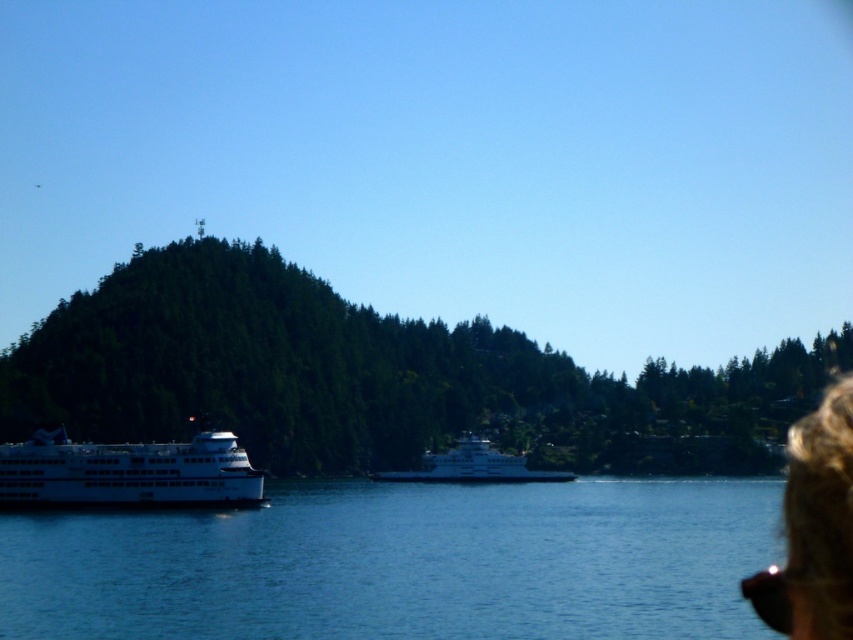
You are a photographer trying to capture both the green textured hillside at center and the white glossy ferry at lower left in a single shot. Which object should you focus on first to ensure both are in frame?

You should focus on the green textured hillside at center first because it is closer to you than the white glossy ferry at lower left, so adjusting the camera to include it ensures the ferry further back will also be in the frame.

You are a passenger on the ferry and want to move from the white glossy ferry at lower left to the white glossy ferry at center. Which direction should you go to reach it?

The white glossy ferry at lower left is to the left of the white glossy ferry at center. To reach the white glossy ferry at center, you should move to the right.